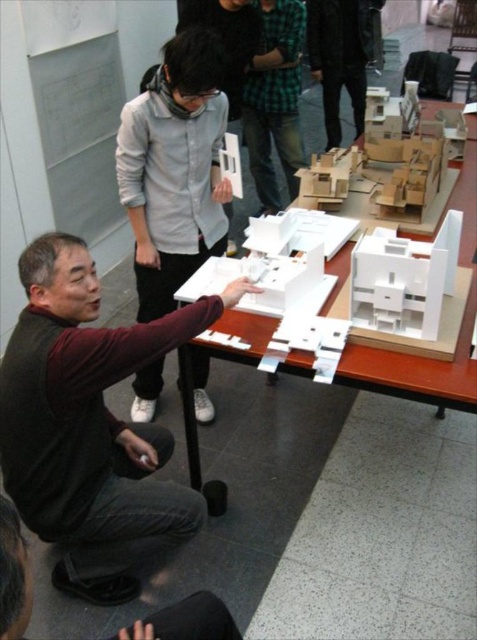
Question: Which object appears farthest from the camera in this image?

Choices:
 (A) white cardboard table at center
 (B) green plaid shirt at upper center
 (C) dark green textured pants at center
 (D) white matte model at center

Answer: (C)

Question: Among these points, which one is nearest to the camera?

Choices:
 (A) (266, 164)
 (B) (157, 611)
 (C) (141, 292)
 (D) (50, 381)

Answer: (D)

Question: Can you confirm if white cardboard table at center is wider than black leather shoes at lower center?

Choices:
 (A) no
 (B) yes

Answer: (B)

Question: Which object is closer to the camera taking this photo?

Choices:
 (A) black leather shoes at lower center
 (B) green plaid shirt at upper center
 (C) dark green textured pants at center
 (D) white matte model at center

Answer: (A)

Question: Can you confirm if green plaid shirt at upper center is positioned to the right of black leather shoes at lower center?

Choices:
 (A) yes
 (B) no

Answer: (A)

Question: Does dark brown sweater at lower left have a larger size compared to white matte model at center?

Choices:
 (A) no
 (B) yes

Answer: (A)